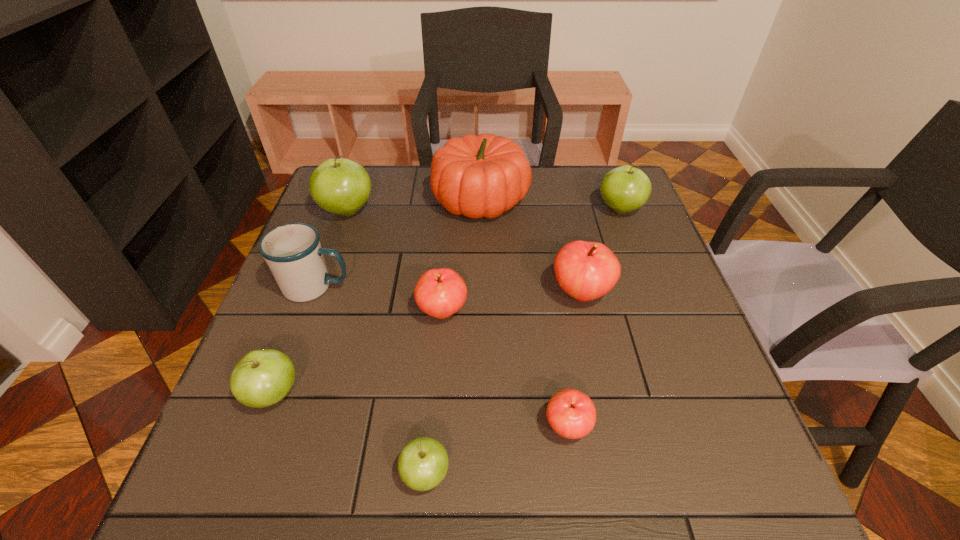
I want to click on empty space between the rightmost object and the pumpkin, so click(x=550, y=204).

Identify the location of free space between the tallest apple and the white mug. The height and width of the screenshot is (540, 960). (332, 249).

Find the location of `unoccupied position between the pumpkin and the tallest apple`. unoccupied position between the pumpkin and the tallest apple is located at coordinates (414, 205).

At what (x,y) coordinates should I click in order to perform the action: click on vacant area between the pumpkin and the biggest green apple. Please return your answer as a coordinate pair (x, y). The width and height of the screenshot is (960, 540). Looking at the image, I should click on (414, 205).

At what (x,y) coordinates should I click in order to perform the action: click on unoccupied position between the white mug and the nearest green apple. Please return your answer as a coordinate pair (x, y). Looking at the image, I should click on (371, 380).

I want to click on vacant space that's between the white mug and the third biggest green apple, so click(x=295, y=340).

Identify the location of free space between the pumpkin and the white mug. Image resolution: width=960 pixels, height=540 pixels. (398, 243).

I want to click on free point between the second smallest green apple and the smallest red apple, so click(x=420, y=410).

Where is `free spot between the leftmost red apple and the pumpkin`? The image size is (960, 540). free spot between the leftmost red apple and the pumpkin is located at coordinates (462, 255).

I want to click on object that ranks as the eighth closest to the tallest apple, so click(571, 413).